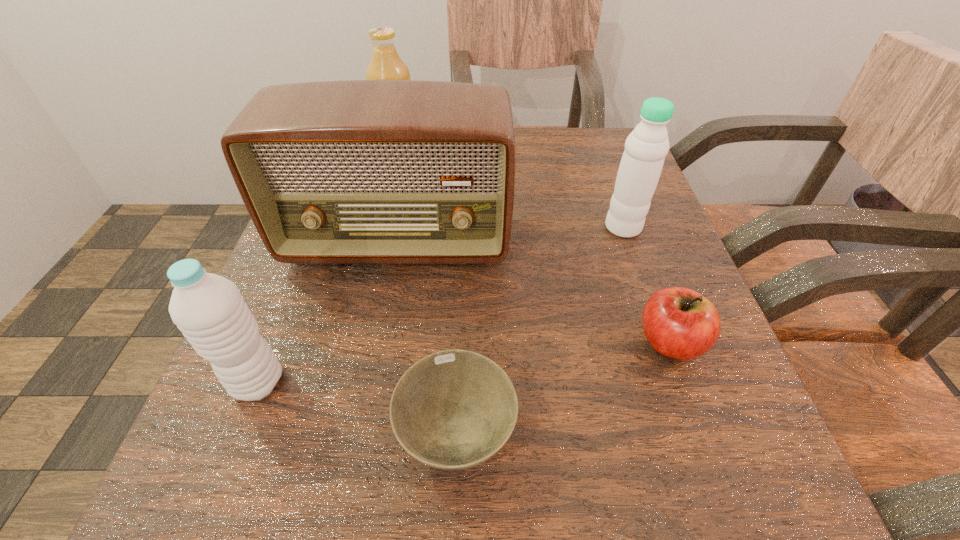
I want to click on blank region between the radio receiver and the nearer water bottle, so click(328, 313).

The width and height of the screenshot is (960, 540). In order to click on vacant point located between the farthest object and the apple in this screenshot , I will do `click(535, 250)`.

Identify the location of free point between the olive oil and the nearer water bottle. The height and width of the screenshot is (540, 960). (329, 270).

Find the location of a particular element. empty space that is in between the apple and the right water bottle is located at coordinates (647, 285).

Locate an element on the screen. empty location between the olive oil and the nearer water bottle is located at coordinates (329, 270).

Locate an element on the screen. This screenshot has height=540, width=960. free spot between the farther water bottle and the shortest object is located at coordinates (540, 330).

Locate an element on the screen. This screenshot has height=540, width=960. object that is the second closest to the radio receiver is located at coordinates (209, 310).

In order to click on the fifth closest object to the nearer water bottle in this screenshot , I will do `click(640, 168)`.

Find the location of `free spot that satisfies the following two spatial constraints: 1. on the front-facing side of the shortest object; 2. on the left side of the radio receiver`. free spot that satisfies the following two spatial constraints: 1. on the front-facing side of the shortest object; 2. on the left side of the radio receiver is located at coordinates (361, 433).

Find the location of a particular element. vacant space that satisfies the following two spatial constraints: 1. on the label of the olive oil; 2. on the left side of the shortest object is located at coordinates (334, 433).